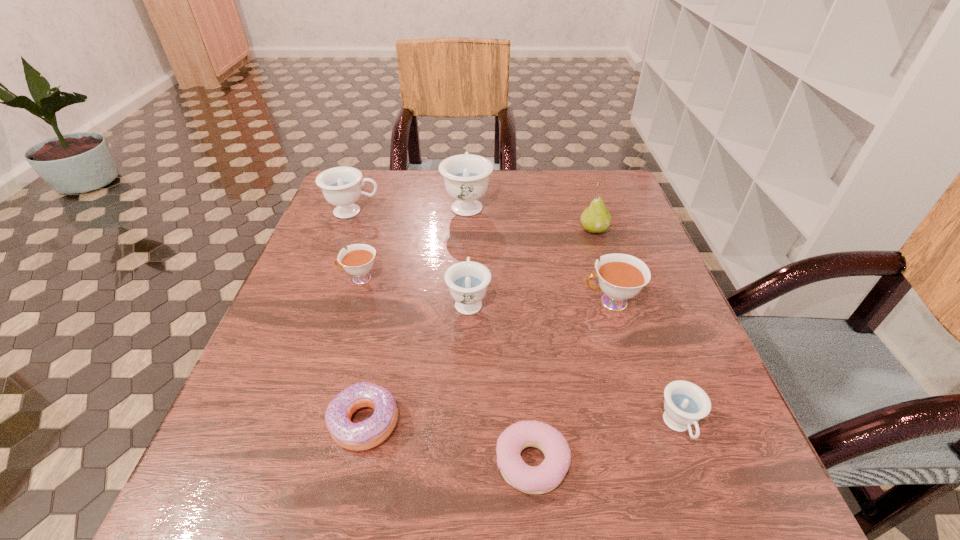
You are a GUI agent. You are given a task and a screenshot of the screen. Output one action in this format:
    pyautogui.click(x=<x>, y=<y>)
    Task: Click on the biggest blue teacup
    The height and width of the screenshot is (540, 960).
    Given the screenshot: What is the action you would take?
    pyautogui.click(x=466, y=176)

In order to click on green pear in this screenshot , I will do `click(596, 218)`.

Locate an element on the screen. the leftmost blue teacup is located at coordinates (341, 187).

Find the location of a particular element. The height and width of the screenshot is (540, 960). the bigger white teacup is located at coordinates (621, 276).

The height and width of the screenshot is (540, 960). Find the location of `the third biggest blue teacup`. the third biggest blue teacup is located at coordinates (467, 280).

This screenshot has height=540, width=960. In order to click on the smaller white teacup in this screenshot , I will do (358, 260).

Identify the location of the nearest blue teacup. The image size is (960, 540). (685, 403).

Identify the location of the nearest teacup. (685, 403).

Locate an element on the screen. This screenshot has height=540, width=960. the left purple doughnut is located at coordinates (371, 432).

This screenshot has width=960, height=540. I want to click on the right doughnut, so click(x=541, y=479).